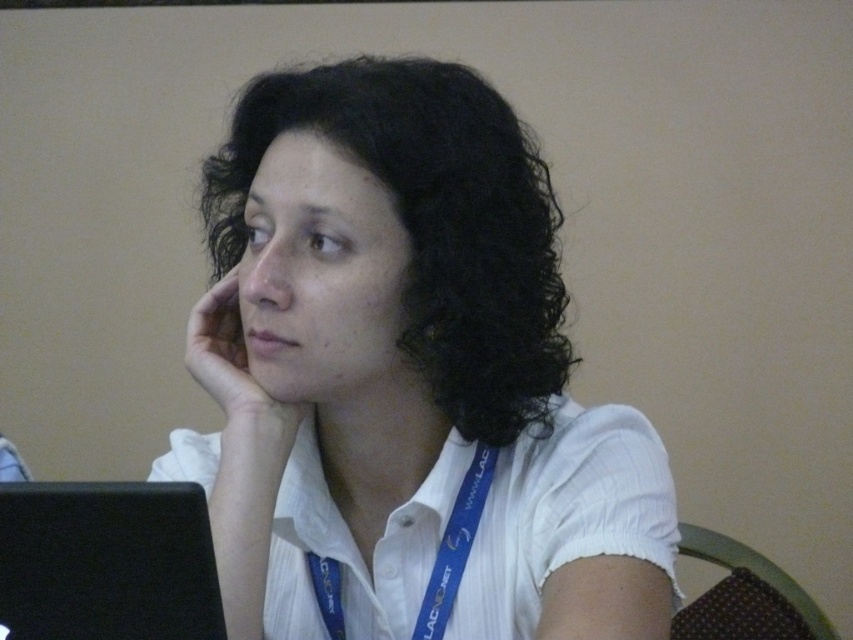
In the scene shown: Can you confirm if blue fabric lanyard at center is positioned to the right of black matte laptop at lower left?

Yes, blue fabric lanyard at center is to the right of black matte laptop at lower left.

Is point (503, 470) positioned in front of point (38, 550)?

No, (503, 470) is behind (38, 550).

At what (x,y) coordinates should I click in order to perform the action: click on blue fabric lanyard at center. Please return your answer as a coordinate pair (x, y). This screenshot has height=640, width=853. Looking at the image, I should click on (393, 554).

Is point (51, 493) more distant than point (195, 324)?

No, it is not.

Does black matte laptop at lower left appear under skinsmoothhand at left?

Yes, black matte laptop at lower left is below skinsmoothhand at left.

I want to click on black matte laptop at lower left, so click(x=106, y=561).

From the picture: Does white matte shirt at center have a smaller size compared to skinsmoothhand at left?

Incorrect, white matte shirt at center is not smaller in size than skinsmoothhand at left.

Which is behind, point (503, 145) or point (252, 435)?

Point (503, 145)

The width and height of the screenshot is (853, 640). Identify the location of white matte shirt at center. (407, 380).

Locate an element on the screen. white matte shirt at center is located at coordinates (407, 380).